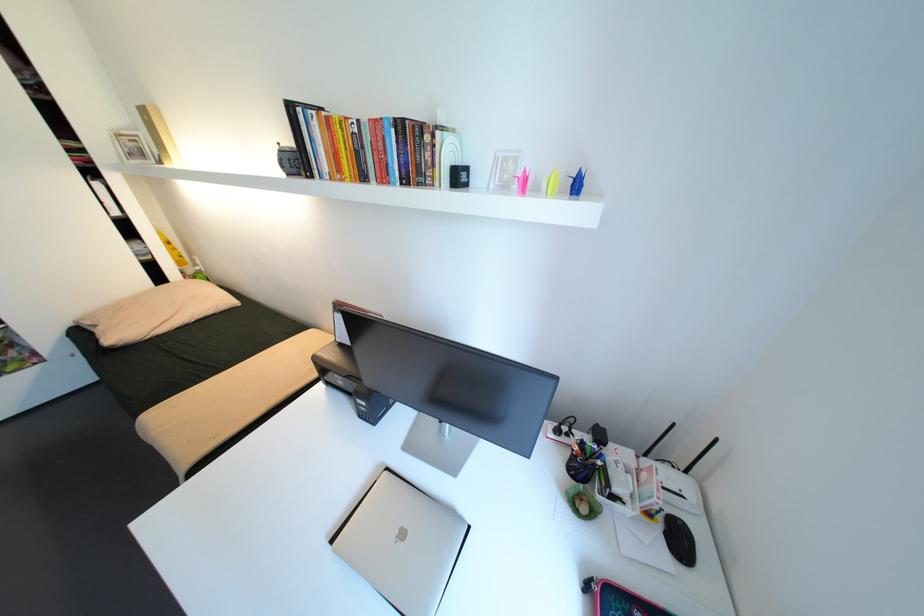
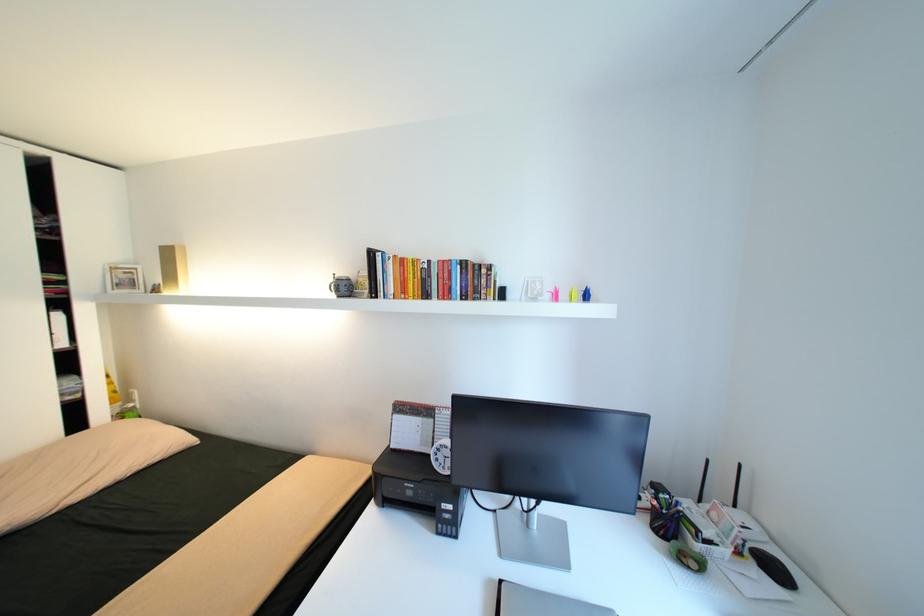
In the second image, find the point that corresponds to point (525, 180) in the first image.

(558, 294)